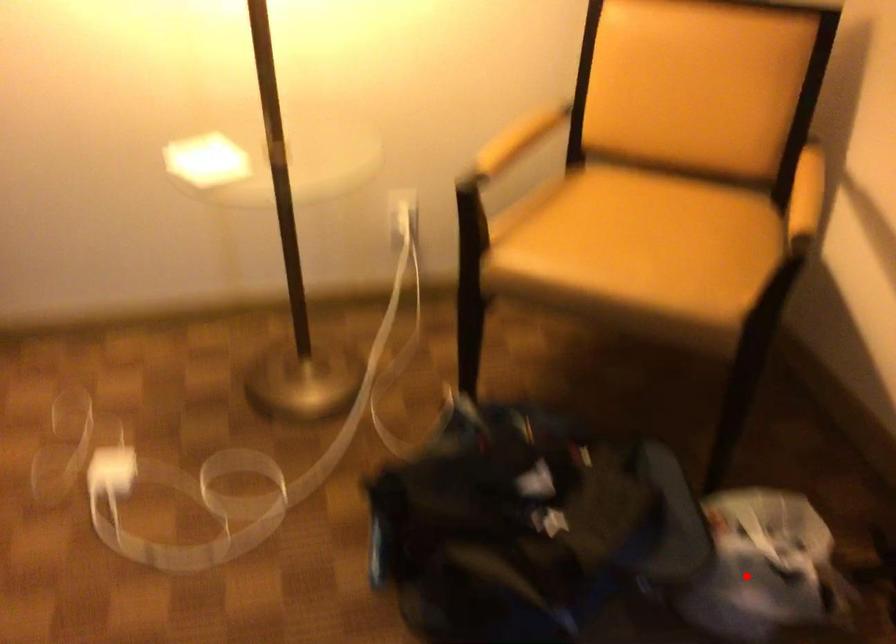
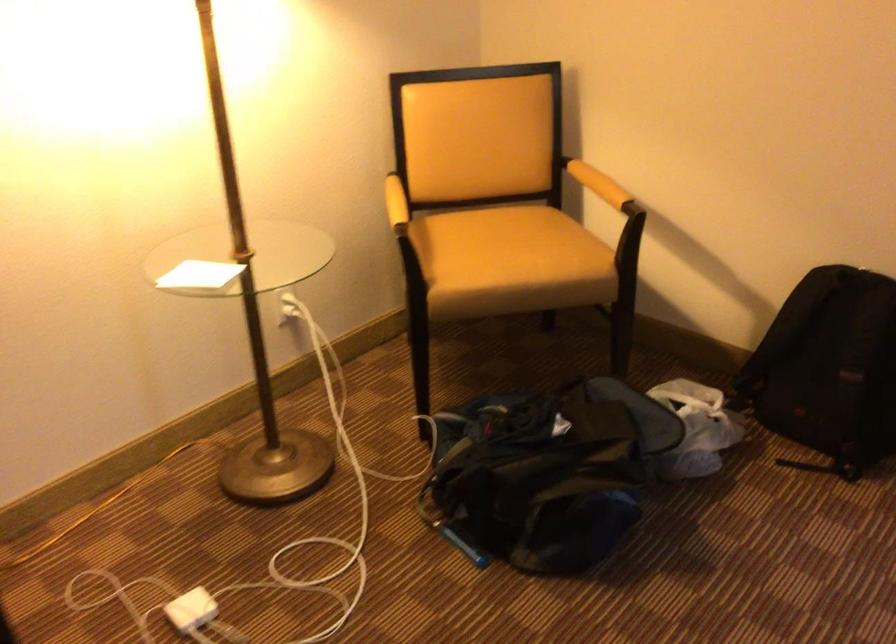
Question: I am providing you with two images of the same scene from different viewpoints. Image1 has a red point marked. In image2, the corresponding 3D location appears at what relative position? Reply with the corresponding letter.

Choices:
 (A) Closer
 (B) Farther

Answer: (B)